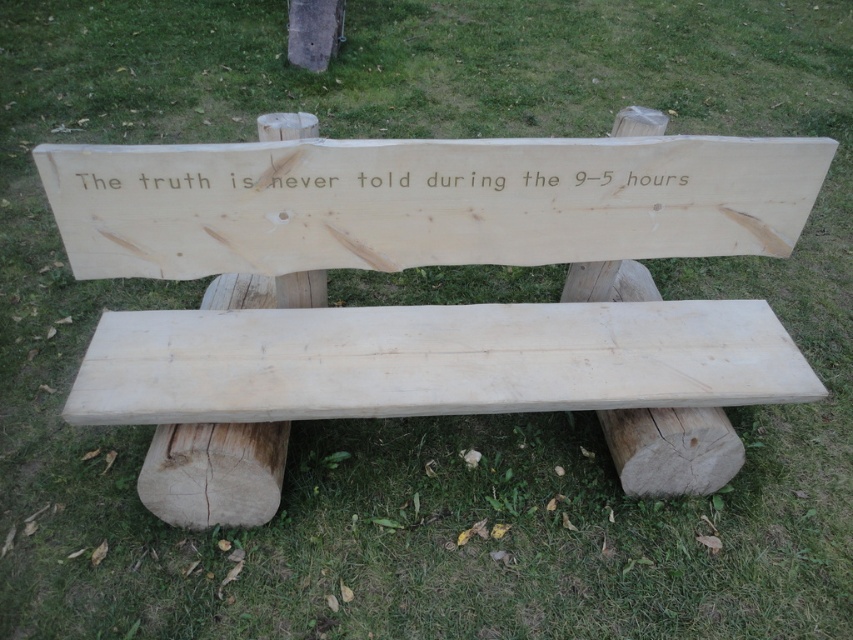
You are an artist planning to paint a scene of the wooden bench with its engraved message. You need to ensure the proportions between the natural wood sign at center and the white wood text at center are accurate. Which one should you draw taller?

The natural wood sign at center should be drawn taller than the white wood text at center as per the description.

You are a visitor at a park and see the natural wood sign at center and the white wood text at center on a bench. Which one is located below the other?

The natural wood sign at center is positioned under the white wood text at center, so the white wood text at center is above and the natural wood sign at center is below.

Based on the photo, you are standing in front of the wooden bench in the image. There is a point marked at coordinates (424, 202). What object is located at this point?

The natural wood sign at center is located at point (424, 202).